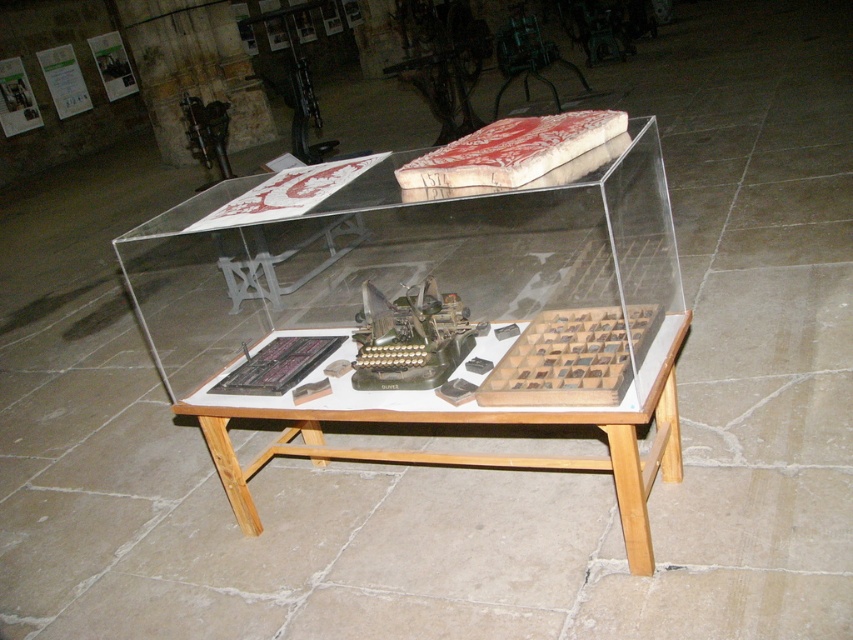
You are a visitor at the museum and want to take a photo of the transparent acrylic box at center. Since you need to avoid the wooden table at center from blocking the view, can you position yourself directly above the box to capture it without obstruction?

The transparent acrylic box at center is located above wooden table at center, so positioning yourself directly above the box would allow you to capture it without the wooden table at center blocking the view.

You are a museum curator trying to move the transparent acrylic box at center and the wooden table at center to a new location. Since the entrance door is narrow, you need to know which one is smaller to carry first. Which object should you pick first?

The wooden table at center is smaller than the transparent acrylic box at center, so you should pick the wooden table at center first to ensure it fits through the narrow entrance door.